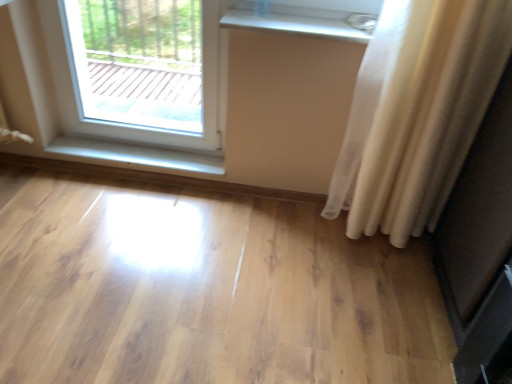
Locate an element on the screen. This screenshot has width=512, height=384. free space above white glossy wood at lower left, the first window sill ordered from the bottom (from a real-world perspective) is located at coordinates (140, 150).